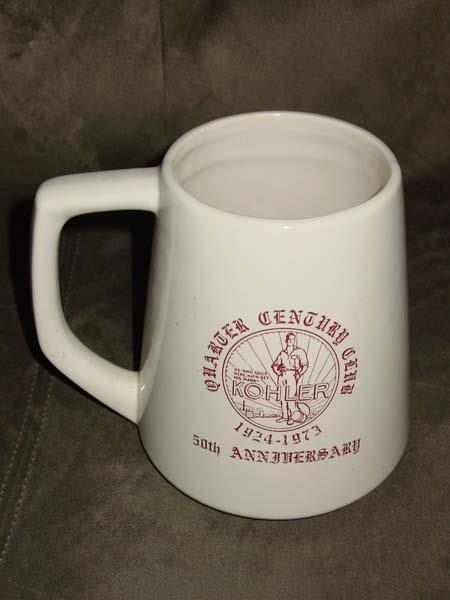
You are a GUI agent. You are given a task and a screenshot of the screen. Output one action in this format:
    pyautogui.click(x=<x>, y=<y>)
    Task: Click on the inside of mug
    The height and width of the screenshot is (600, 450).
    Given the screenshot: What is the action you would take?
    pyautogui.click(x=275, y=175)